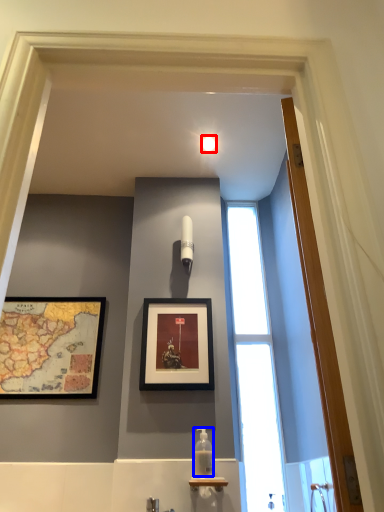
Question: Which object appears farthest to the camera in this image, light fixture (highlighted by a red box) or bottle (highlighted by a blue box)?

Choices:
 (A) light fixture
 (B) bottle

Answer: (A)